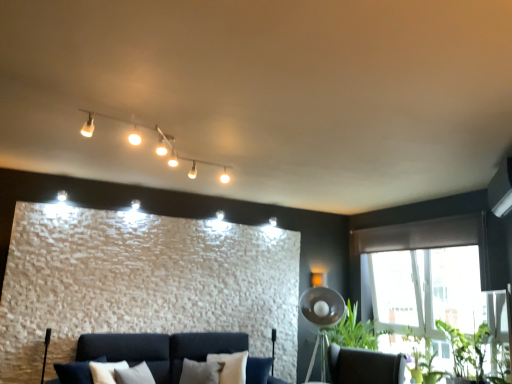
Question: Considering the relative positions of metallic silver tripod lamp at lower right and brown fabric curtain at upper right in the image provided, is metallic silver tripod lamp at lower right behind brown fabric curtain at upper right?

Choices:
 (A) no
 (B) yes

Answer: (B)

Question: From the image's perspective, is metallic silver tripod lamp at lower right under brown fabric curtain at upper right?

Choices:
 (A) no
 (B) yes

Answer: (B)

Question: From a real-world perspective, is metallic silver tripod lamp at lower right under brown fabric curtain at upper right?

Choices:
 (A) yes
 (B) no

Answer: (A)

Question: Is the depth of metallic silver tripod lamp at lower right less than that of brown fabric curtain at upper right?

Choices:
 (A) no
 (B) yes

Answer: (A)

Question: Is metallic silver tripod lamp at lower right thinner than brown fabric curtain at upper right?

Choices:
 (A) no
 (B) yes

Answer: (A)

Question: Would you consider metallic silver tripod lamp at lower right to be distant from brown fabric curtain at upper right?

Choices:
 (A) no
 (B) yes

Answer: (B)

Question: Can you confirm if matte white track lights at upper center is positioned to the left of metallic silver tripod lamp at lower right?

Choices:
 (A) yes
 (B) no

Answer: (A)

Question: Does matte white track lights at upper center appear on the right side of metallic silver tripod lamp at lower right?

Choices:
 (A) no
 (B) yes

Answer: (A)

Question: Considering the relative sizes of matte white track lights at upper center and metallic silver tripod lamp at lower right in the image provided, is matte white track lights at upper center thinner than metallic silver tripod lamp at lower right?

Choices:
 (A) yes
 (B) no

Answer: (B)

Question: Can we say matte white track lights at upper center lies outside metallic silver tripod lamp at lower right?

Choices:
 (A) yes
 (B) no

Answer: (A)

Question: From a real-world perspective, does matte white track lights at upper center sit lower than metallic silver tripod lamp at lower right?

Choices:
 (A) yes
 (B) no

Answer: (B)

Question: Is matte white track lights at upper center further to camera compared to metallic silver tripod lamp at lower right?

Choices:
 (A) yes
 (B) no

Answer: (B)

Question: Is green leafy plant at lower right, the second plant in the back-to-front sequence, surrounded by dark brown leather swivel chair at lower right?

Choices:
 (A) yes
 (B) no

Answer: (B)